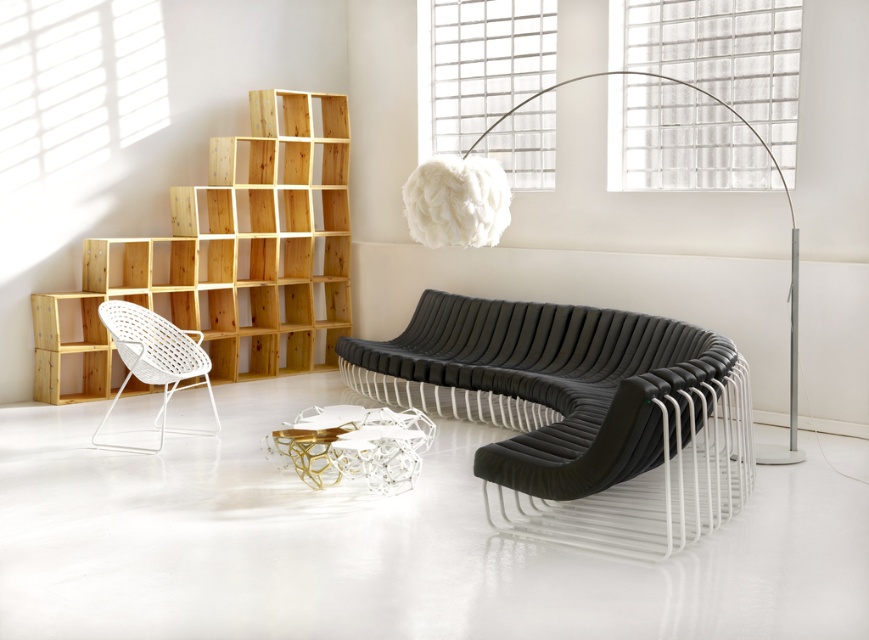
Question: Does black leather daybed at center appear on the left side of natural wood bookshelf at left?

Choices:
 (A) yes
 (B) no

Answer: (B)

Question: Can you confirm if black leather daybed at center is smaller than white woven armchair at left?

Choices:
 (A) no
 (B) yes

Answer: (A)

Question: Which object is farther from the camera taking this photo?

Choices:
 (A) black leather daybed at center
 (B) natural wood bookshelf at left

Answer: (B)

Question: Is black leather daybed at center above white woven armchair at left?

Choices:
 (A) no
 (B) yes

Answer: (A)

Question: Which point is closer to the camera taking this photo?

Choices:
 (A) (98, 364)
 (B) (395, 362)
 (C) (184, 355)

Answer: (C)

Question: Which object appears closest to the camera in this image?

Choices:
 (A) natural wood bookshelf at left
 (B) white woven armchair at left

Answer: (B)